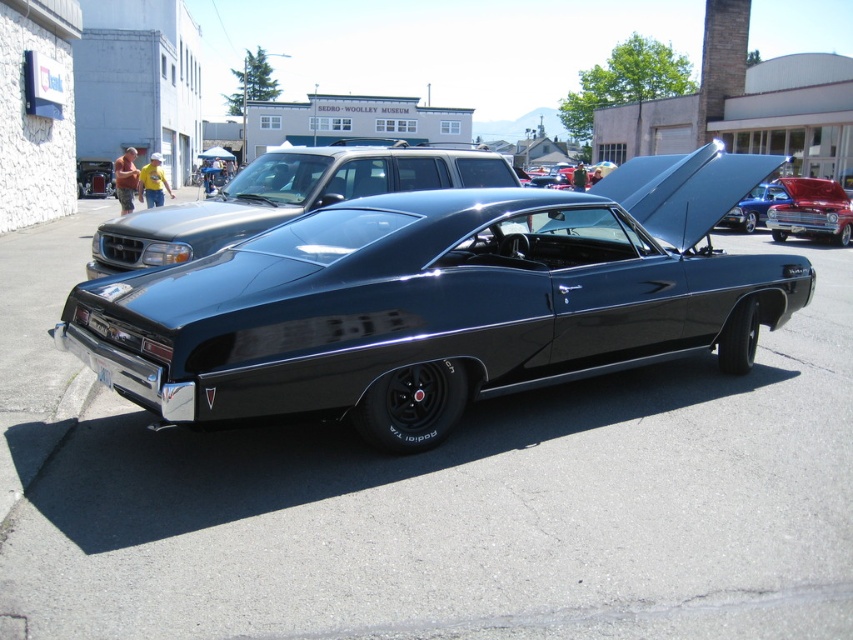
Does shiny black muscle car at center have a larger size compared to glossy black car at center?

Correct, shiny black muscle car at center is larger in size than glossy black car at center.

Find the location of a particular element. shiny black muscle car at center is located at coordinates (440, 300).

You are a GUI agent. You are given a task and a screenshot of the screen. Output one action in this format:
    pyautogui.click(x=<x>, y=<y>)
    Task: Click on the shiny black muscle car at center
    
    Given the screenshot: What is the action you would take?
    pyautogui.click(x=440, y=300)

Consider the image. Is glossy black car at center above shiny red car at upper right?

No, glossy black car at center is not above shiny red car at upper right.

Can you confirm if glossy black car at center is shorter than shiny red car at upper right?

Yes, glossy black car at center is shorter than shiny red car at upper right.

Does point (415, 186) come farther from viewer compared to point (825, 216)?

No.

Find the location of a particular element. Image resolution: width=853 pixels, height=640 pixels. glossy black car at center is located at coordinates (283, 198).

You are a GUI agent. You are given a task and a screenshot of the screen. Output one action in this format:
    pyautogui.click(x=<x>, y=<y>)
    Task: Click on the shiny black muscle car at center
    The width and height of the screenshot is (853, 640).
    Given the screenshot: What is the action you would take?
    pyautogui.click(x=440, y=300)

Who is more forward, (149, 342) or (788, 209)?

Point (149, 342) is in front.

Find the location of a particular element. The height and width of the screenshot is (640, 853). shiny black muscle car at center is located at coordinates (440, 300).